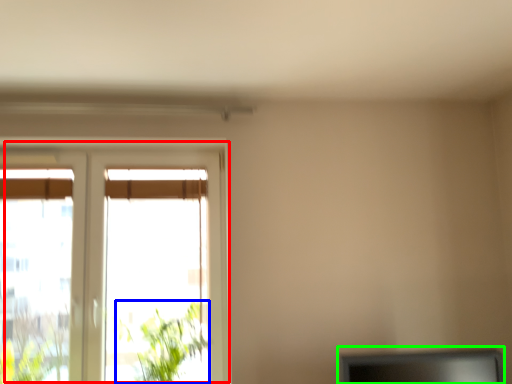
Question: Which is farther away from window (highlighted by a red box)? plant (highlighted by a blue box) or computer monitor (highlighted by a green box)?

Choices:
 (A) plant
 (B) computer monitor

Answer: (B)